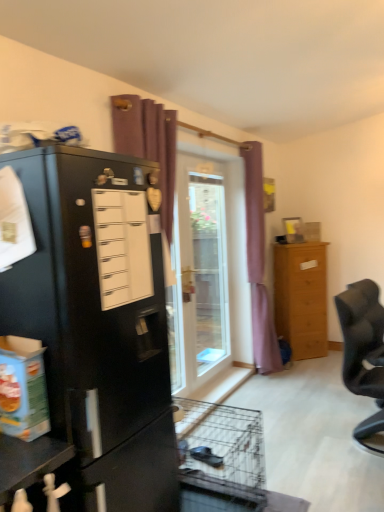
Question: Which direction should I rotate to look at purple fabric curtain at center, which is the 1th curtain in right-to-left order?

Choices:
 (A) left
 (B) right

Answer: (B)

Question: Is transparent glass door at center thinner than light brown wooden chest of drawers at right?

Choices:
 (A) yes
 (B) no

Answer: (A)

Question: Can you confirm if transparent glass door at center is taller than light brown wooden chest of drawers at right?

Choices:
 (A) yes
 (B) no

Answer: (A)

Question: Considering the relative sizes of transparent glass door at center and light brown wooden chest of drawers at right in the image provided, is transparent glass door at center shorter than light brown wooden chest of drawers at right?

Choices:
 (A) yes
 (B) no

Answer: (B)

Question: Is the position of transparent glass door at center more distant than that of light brown wooden chest of drawers at right?

Choices:
 (A) yes
 (B) no

Answer: (B)

Question: From a real-world perspective, is transparent glass door at center physically below light brown wooden chest of drawers at right?

Choices:
 (A) yes
 (B) no

Answer: (B)

Question: Is transparent glass door at center smaller than light brown wooden chest of drawers at right?

Choices:
 (A) no
 (B) yes

Answer: (B)

Question: Is black fabric chair at right thinner than purple fabric curtain at upper center, the 1th curtain when ordered from front to back?

Choices:
 (A) yes
 (B) no

Answer: (B)

Question: Can you confirm if black fabric chair at right is smaller than purple fabric curtain at upper center, marked as the second curtain in a right-to-left arrangement?

Choices:
 (A) yes
 (B) no

Answer: (A)

Question: Considering the relative sizes of black fabric chair at right and purple fabric curtain at upper center, the second curtain when ordered from back to front, in the image provided, is black fabric chair at right shorter than purple fabric curtain at upper center, the second curtain when ordered from back to front,?

Choices:
 (A) yes
 (B) no

Answer: (A)

Question: Does black fabric chair at right have a greater height compared to purple fabric curtain at upper center, the 1th curtain when ordered from front to back?

Choices:
 (A) no
 (B) yes

Answer: (A)

Question: From a real-world perspective, is black fabric chair at right located beneath purple fabric curtain at upper center, the second curtain when ordered from back to front?

Choices:
 (A) no
 (B) yes

Answer: (B)

Question: Is black fabric chair at right to the right of purple fabric curtain at upper center, the 1th curtain when ordered from front to back, from the viewer's perspective?

Choices:
 (A) no
 (B) yes

Answer: (B)

Question: Is transparent glass door at center positioned far away from purple fabric curtain at center, marked as the second curtain in a front-to-back arrangement?

Choices:
 (A) yes
 (B) no

Answer: (B)